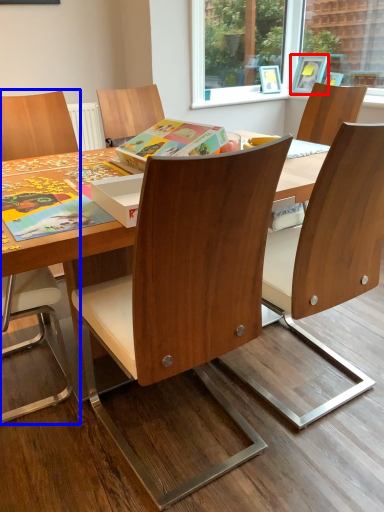
Question: Which object appears farthest to the camera in this image, picture frame (highlighted by a red box) or chair (highlighted by a blue box)?

Choices:
 (A) picture frame
 (B) chair

Answer: (A)